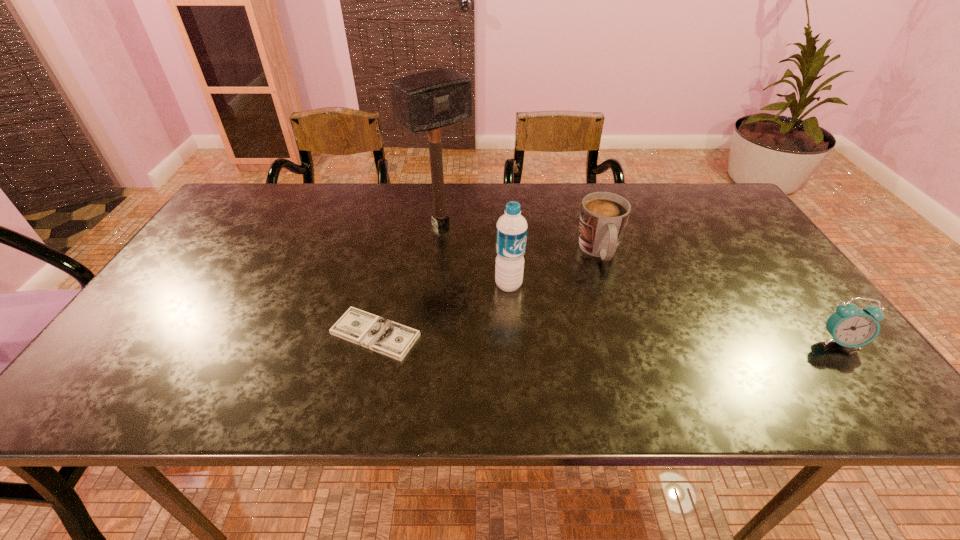
The image size is (960, 540). What are the coordinates of `vacant spot on the desktop that is between the shortest object and the alarm clock and is positioned on the side of the mug with the handle` in the screenshot? It's located at (627, 338).

This screenshot has height=540, width=960. I want to click on vacant spot on the desktop that is between the shortest object and the alarm clock and is positioned on the label of the third object from right to left, so click(583, 338).

Where is `free spot on the desktop that is between the shortest object and the rightmost object and is positioned on the head of the mallet`? This screenshot has height=540, width=960. free spot on the desktop that is between the shortest object and the rightmost object and is positioned on the head of the mallet is located at coordinates (564, 338).